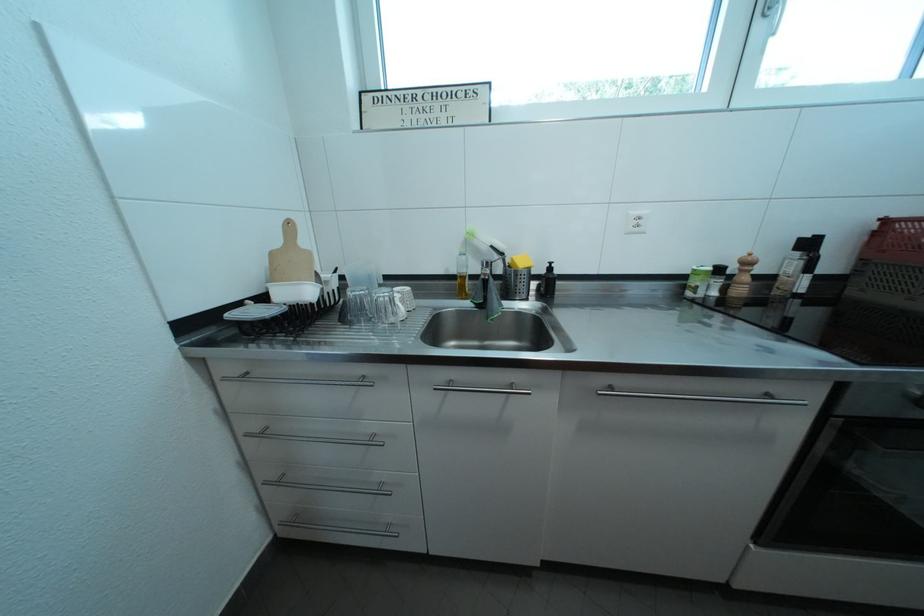
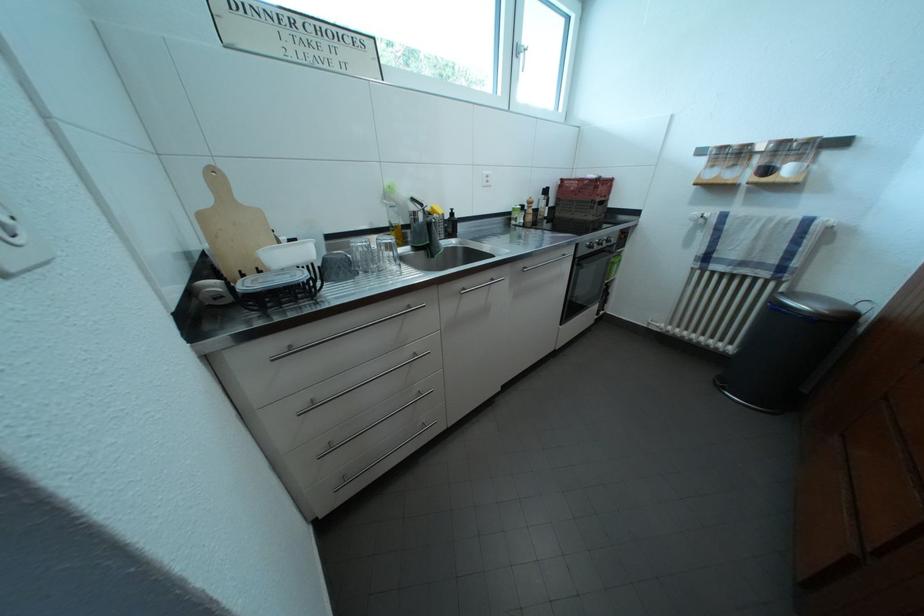
In the second image, find the point that corresponds to [850,392] in the first image.

(587, 251)